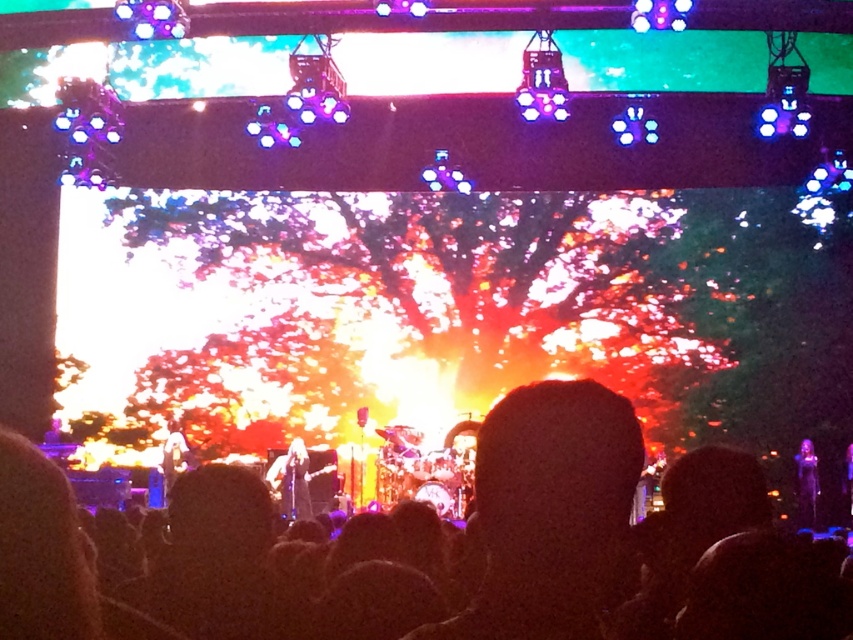
You are a stagehand who needs to place a protective cover over both the shiny black guitar at center and the shiny silver guitar at center. Given that the cover is designed to fit the larger guitar, will it also fit the smaller one?

The shiny black guitar at center is smaller than the shiny silver guitar at center, so the protective cover designed for the larger shiny silver guitar at center should also fit the smaller shiny black guitar at center.

Looking at this image, you are a photographer standing at the camera position. You want to capture a closeup shot of the drummer in the center of the stage. The drummer is located at point (729,518). What is the minimum focal length required to frame the drummer properly if the sensor size is 24mm x 36mm and the drummer occupies 50mm of the sensor width?

The minimum focal length required is calculated using the formula Focal Length Formula Focal Length Formula Focal Length Formula Focal Length Formula Focal Length Formula Focal Length Formula Focal Length Formula Focal Length Formula Focal Length Formula Focal Length Formula Focal Length Formula Focal Length Formula Focal Length Formula Focal Length Formula Focal Length Formula Focal Length Formula Focal Length Formula Focal Length Formula Focal Length Formula Focal Length Formula Focal Length Formula Focal